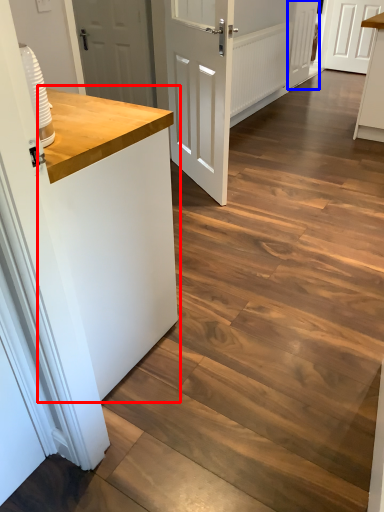
Question: Which object is closer to the camera taking this photo, counter top (highlighted by a red box) or door (highlighted by a blue box)?

Choices:
 (A) counter top
 (B) door

Answer: (A)